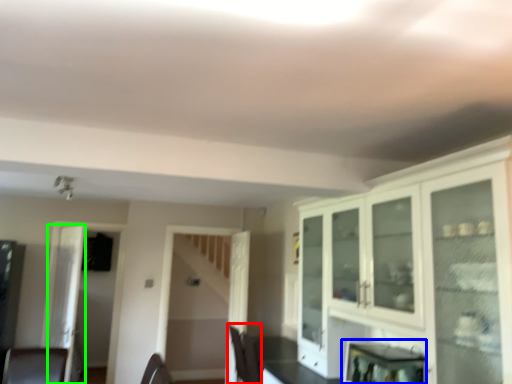
Question: Considering the real-world distances, which object is closest to chair (highlighted by a red box)? appliance (highlighted by a blue box) or glass door (highlighted by a green box).

Choices:
 (A) appliance
 (B) glass door

Answer: (A)